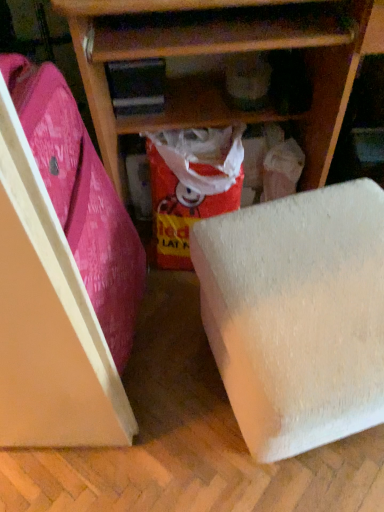
This screenshot has height=512, width=384. What are the coordinates of `free spot above white foam block at lower right (from a real-world perspective)` in the screenshot? It's located at (310, 274).